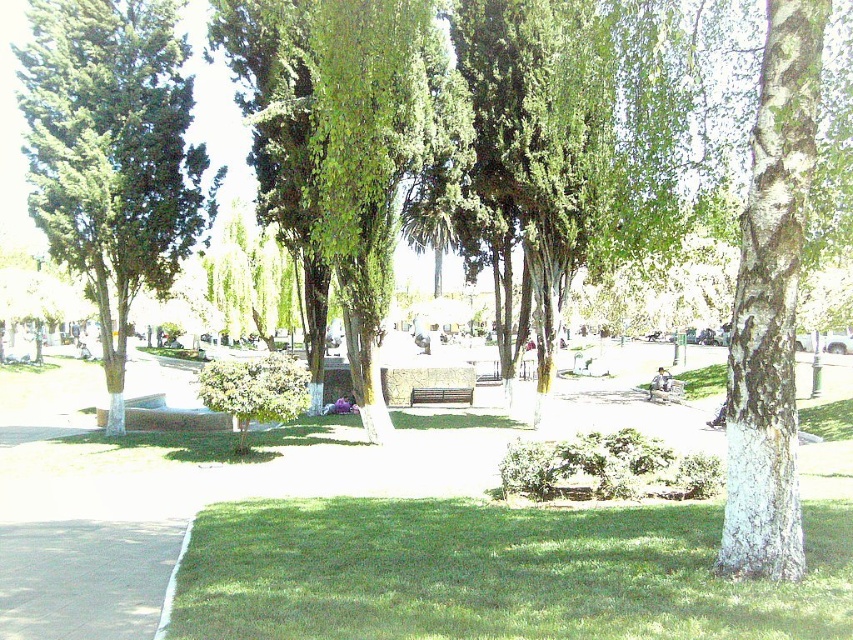
Which is behind, point (595, 584) or point (172, 259)?

The point (172, 259) is more distant.

Can you confirm if green grass at lower center is positioned above green leafy tree at left?

Incorrect, green grass at lower center is not positioned above green leafy tree at left.

Does point (228, 570) come in front of point (45, 68)?

That is True.

Locate an element on the screen. The image size is (853, 640). green grass at lower center is located at coordinates (494, 573).

Does green leafy tree at left appear over metallic silver bench at center?

Yes.

The width and height of the screenshot is (853, 640). What do you see at coordinates (112, 154) in the screenshot?
I see `green leafy tree at left` at bounding box center [112, 154].

Which is behind, point (113, 29) or point (428, 392)?

The point (428, 392) is more distant.

Where is `green leafy tree at left`? Image resolution: width=853 pixels, height=640 pixels. green leafy tree at left is located at coordinates (112, 154).

You are a GUI agent. You are given a task and a screenshot of the screen. Output one action in this format:
    pyautogui.click(x=<x>, y=<y>)
    Task: Click on the white bark tree at right
    The height and width of the screenshot is (640, 853).
    Given the screenshot: What is the action you would take?
    tap(770, 304)

Identify the location of white bark tree at right. The height and width of the screenshot is (640, 853). coord(770,304).

The width and height of the screenshot is (853, 640). In order to click on white bark tree at right in this screenshot , I will do `click(770, 304)`.